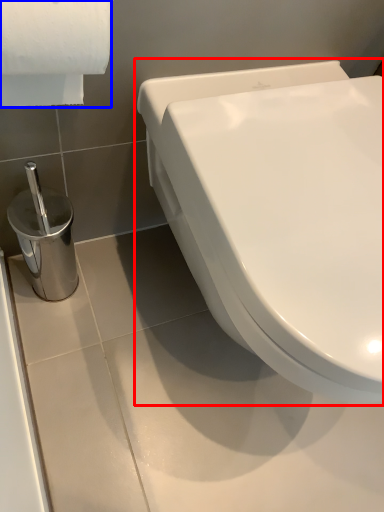
Question: Among these objects, which one is farthest to the camera, toilet (highlighted by a red box) or toilet paper (highlighted by a blue box)?

Choices:
 (A) toilet
 (B) toilet paper

Answer: (A)